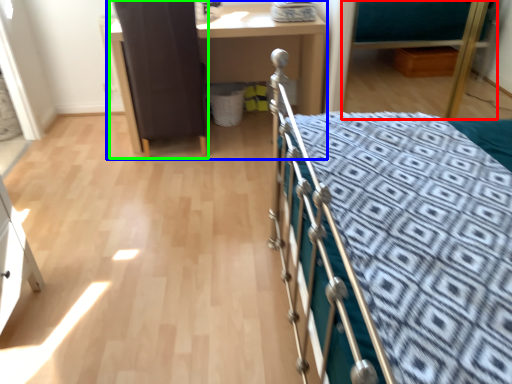
Question: Considering the real-world distances, which object is farthest from hospital bed (highlighted by a red box)? desk (highlighted by a blue box) or screen door (highlighted by a green box)?

Choices:
 (A) desk
 (B) screen door

Answer: (B)